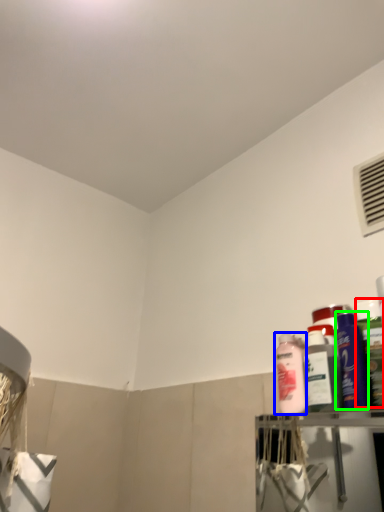
Question: Based on their relative distances, which object is farther from cleaning product (highlighted by a red box)? Choose from cleaning product (highlighted by a blue box) and cleaning product (highlighted by a green box).

Choices:
 (A) cleaning product
 (B) cleaning product

Answer: (A)